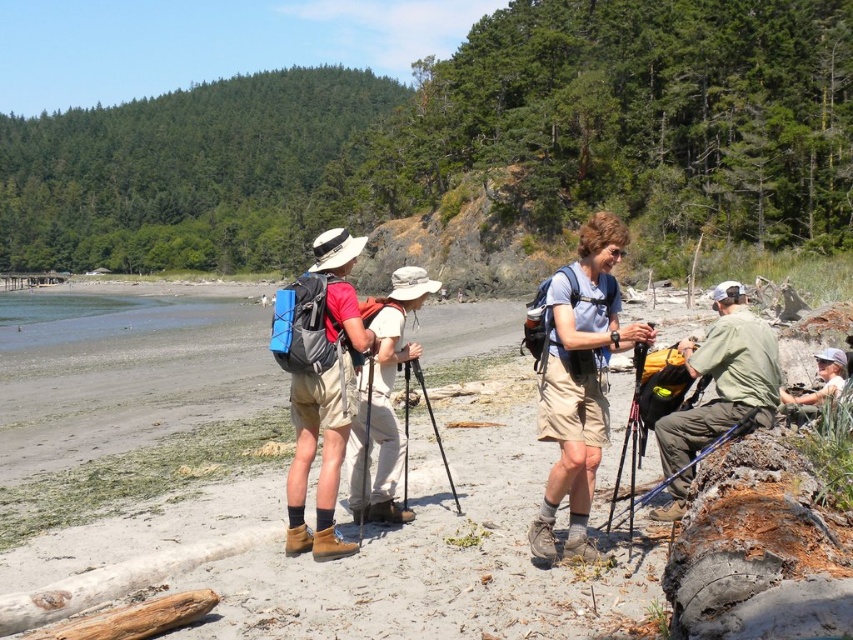
You are standing at the position of the seated hiker on the driftwood. You want to reach the nearest point between point (575, 429) and point (405, 476). Which point should you head towards?

Point (575, 429) is closer to the viewer than point (405, 476), so you should head towards point (575, 429) to reach the nearest point.

You are a hiker standing at the point marked by the coordinates point [352,556]. Looking around, you see the smooth sand beach at center. Which direction should you walk to reach the nearest hiker?

The point [352,556] marks the smooth sand beach at center. Since the nearest hiker is not specified in the scene description, it is impossible to determine the direction to walk.